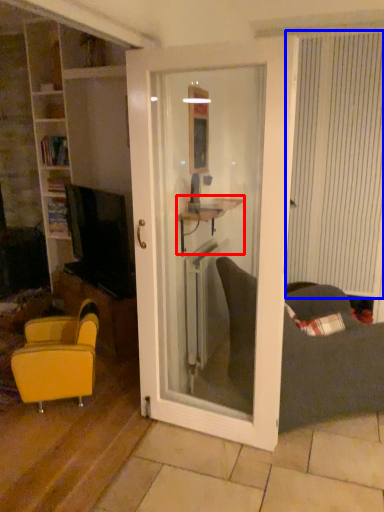
Question: Which object appears farthest to the camera in this image, table (highlighted by a red box) or curtain (highlighted by a blue box)?

Choices:
 (A) table
 (B) curtain

Answer: (B)